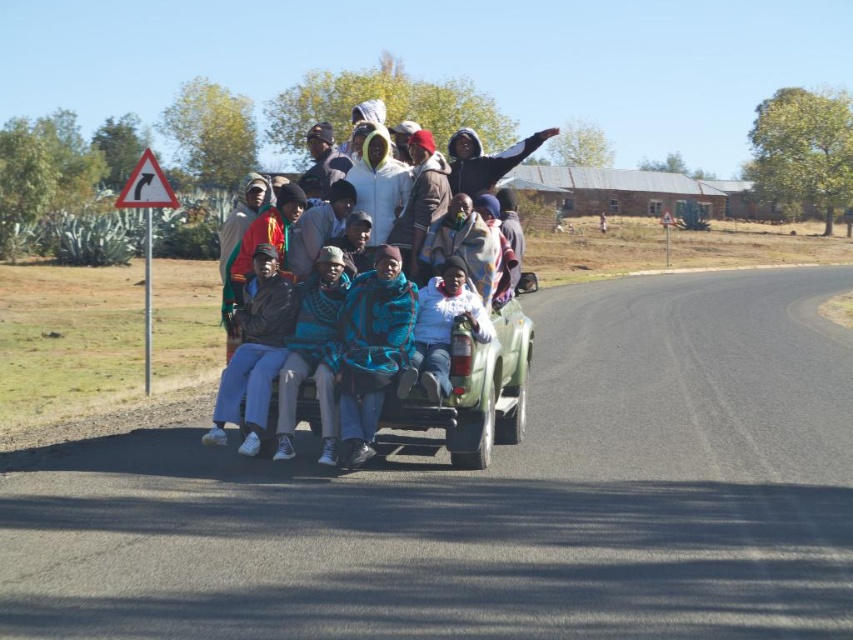
Question: Does multicolored woven blanket at center come behind white fleece jacket at center?

Choices:
 (A) no
 (B) yes

Answer: (B)

Question: Which point is farther from the camera taking this photo?

Choices:
 (A) (473, 147)
 (B) (448, 337)

Answer: (A)

Question: Is multicolored woven blanket at center wider than white fleece jacket at center?

Choices:
 (A) no
 (B) yes

Answer: (B)

Question: Where is multicolored woven blanket at center located in relation to white fleece jacket at center in the image?

Choices:
 (A) right
 (B) left

Answer: (B)

Question: Which of the following is the farthest from the observer?

Choices:
 (A) multicolored woven blanket at center
 (B) white fleece jacket at center

Answer: (A)